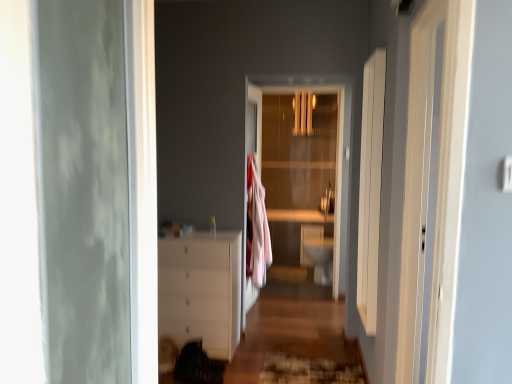
Question: Looking at their shapes, would you say transparent glass door at center is wider or thinner than textured brown rug at lower center?

Choices:
 (A) thin
 (B) wide

Answer: (A)

Question: From a real-world perspective, is transparent glass door at center positioned above or below textured brown rug at lower center?

Choices:
 (A) above
 (B) below

Answer: (A)

Question: Estimate the real-world distances between objects in this image. Which object is farther from the white glossy dresser at lower left?

Choices:
 (A) transparent glass door at center
 (B) white glossy toilet bowl at center
 (C) white glossy chest of drawers at center
 (D) textured brown rug at lower center

Answer: (B)

Question: Considering the real-world distances, which object is farthest from the white glossy chest of drawers at center?

Choices:
 (A) white glossy toilet bowl at center
 (B) textured brown rug at lower center
 (C) white glossy dresser at lower left
 (D) transparent glass door at center

Answer: (A)